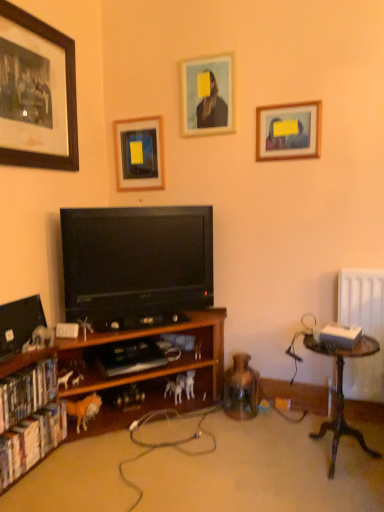
What are the coordinates of `empty space that is in between orange plush horse at lower left, placed as the second animal when sorted from right to left, and wooden table at right` in the screenshot? It's located at (216, 449).